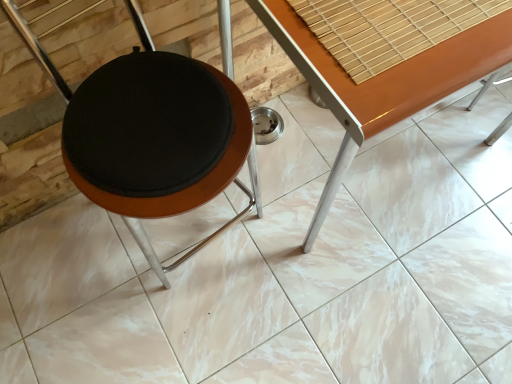
Question: Is matte black stool at center taller or shorter than wooden glossy table at center?

Choices:
 (A) short
 (B) tall

Answer: (B)

Question: From the image's perspective, is matte black stool at center positioned above or below wooden glossy table at center?

Choices:
 (A) above
 (B) below

Answer: (B)

Question: Which is correct: matte black stool at center is inside wooden glossy table at center, or outside of it?

Choices:
 (A) inside
 (B) outside

Answer: (B)

Question: In terms of height, does wooden glossy table at center look taller or shorter compared to matte black stool at center?

Choices:
 (A) tall
 (B) short

Answer: (B)

Question: From the image's perspective, is wooden glossy table at center located above or below matte black stool at center?

Choices:
 (A) below
 (B) above

Answer: (B)

Question: Considering their positions, is wooden glossy table at center located in front of or behind matte black stool at center?

Choices:
 (A) front
 (B) behind

Answer: (B)

Question: Is wooden glossy table at center bigger or smaller than matte black stool at center?

Choices:
 (A) big
 (B) small

Answer: (A)